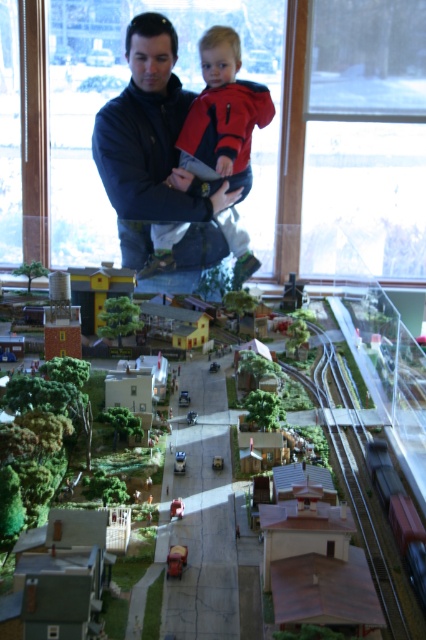
Question: Which of the following is the closest to the observer?

Choices:
 (A) red matte train car at bottom right
 (B) dark blue jacket at upper center
 (C) metallic red car at center

Answer: (A)

Question: Considering the relative positions of red matte train car at bottom right and metallic red fire truck at center in the image provided, where is red matte train car at bottom right located with respect to metallic red fire truck at center?

Choices:
 (A) right
 (B) left

Answer: (A)

Question: Can you confirm if dark blue jacket at upper center is positioned to the left of red matte train car at bottom right?

Choices:
 (A) yes
 (B) no

Answer: (A)

Question: Based on their relative distances, which object is farther from the red matte train car at bottom right?

Choices:
 (A) metallic red fire truck at center
 (B) dark blue jacket at upper center
 (C) metallic red car at center

Answer: (B)

Question: Is dark blue jacket at upper center behind metallic red car at center?

Choices:
 (A) no
 (B) yes

Answer: (B)

Question: Which of the following is the farthest from the observer?

Choices:
 (A) red matte train car at bottom right
 (B) dark blue jacket at upper center
 (C) metallic red fire truck at center
 (D) metallic red car at center

Answer: (B)